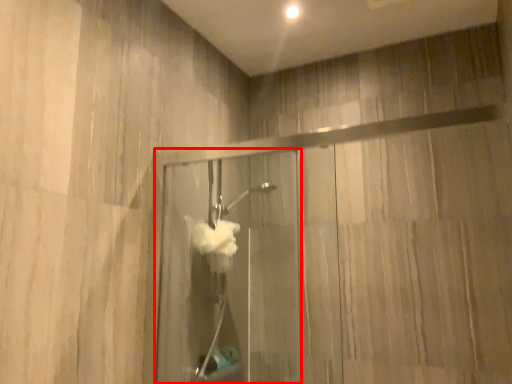
Question: From the image's perspective, where is screen door (annotated by the red box) located relative to glass door?

Choices:
 (A) above
 (B) below

Answer: (B)